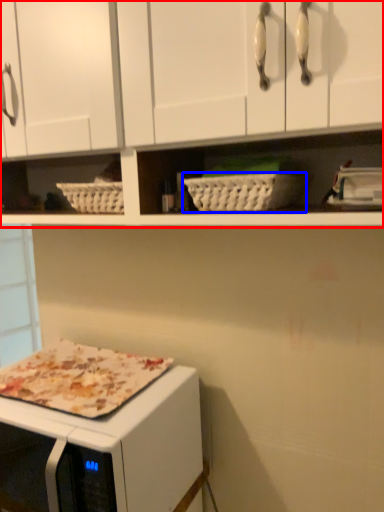
Question: Which object is closer to the camera taking this photo, cabinetry (highlighted by a red box) or basket (highlighted by a blue box)?

Choices:
 (A) cabinetry
 (B) basket

Answer: (A)